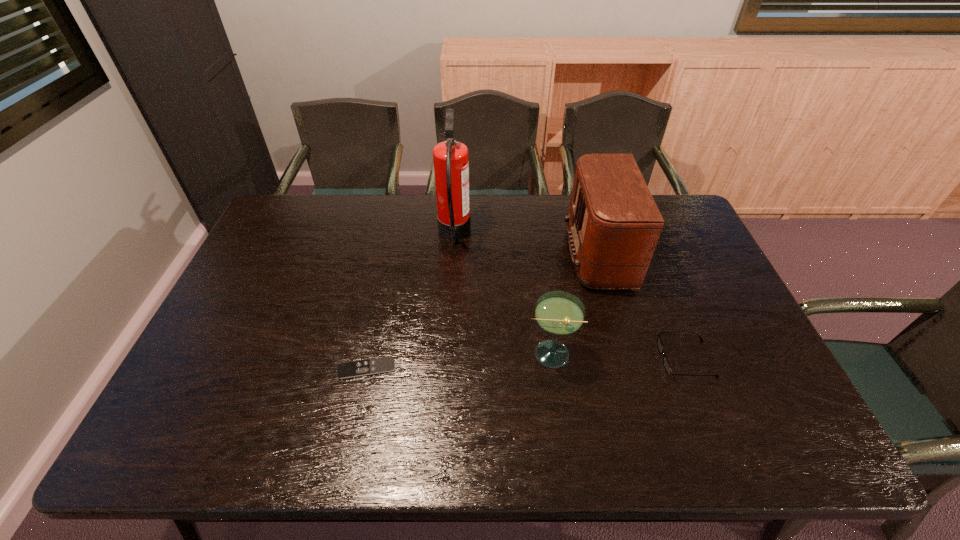
What are the coordinates of `vacant space situated on the front panel of the fourth shortest object` in the screenshot? It's located at (513, 255).

Image resolution: width=960 pixels, height=540 pixels. In order to click on blank area located 0.310m on the front panel of the fourth shortest object in this screenshot , I will do `click(468, 255)`.

Locate an element on the screen. The image size is (960, 540). free space located on the left of the third object from left to right is located at coordinates 442,354.

This screenshot has width=960, height=540. In order to click on vacant space located on the front-facing side of the spectacles in this screenshot , I will do `click(605, 359)`.

Where is `blank space located 0.100m on the front-facing side of the spectacles`? The image size is (960, 540). blank space located 0.100m on the front-facing side of the spectacles is located at coordinates (620, 359).

I want to click on free space located 0.150m on the front-facing side of the spectacles, so click(601, 359).

At what (x,y) coordinates should I click in order to perform the action: click on free space located 0.280m on the back of the shortest object. Please return your answer as a coordinate pair (x, y). Looking at the image, I should click on (385, 280).

Identify the location of fire extinguisher present at the far edge. (451, 158).

Identify the location of radio receiver located at the far edge. (614, 224).

This screenshot has width=960, height=540. Find the location of `radio receiver that is at the right edge`. radio receiver that is at the right edge is located at coordinates (614, 224).